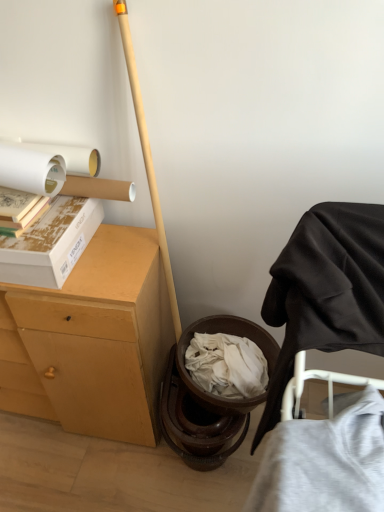
The height and width of the screenshot is (512, 384). Describe the element at coordinates (97, 337) in the screenshot. I see `light brown wood desk at left` at that location.

The width and height of the screenshot is (384, 512). Describe the element at coordinates (326, 291) in the screenshot. I see `black fabric chair at right` at that location.

What do you see at coordinates (44, 166) in the screenshot? I see `white matte toilet paper at upper left` at bounding box center [44, 166].

Measure the distance between point (46, 247) and camera.

The distance of point (46, 247) from camera is 1.04 meters.

What do you see at coordinates (50, 243) in the screenshot? I see `white cardboard box at upper left` at bounding box center [50, 243].

This screenshot has width=384, height=512. Find the location of `light brown wood desk at left`. light brown wood desk at left is located at coordinates (97, 337).

Would you say gray cotton t-shirt at lower right is inside or outside white matte toilet paper at upper left?

gray cotton t-shirt at lower right is spatially situated outside white matte toilet paper at upper left.

Considering the sizes of gray cotton t-shirt at lower right and white matte toilet paper at upper left in the image, is gray cotton t-shirt at lower right taller or shorter than white matte toilet paper at upper left?

Clearly, gray cotton t-shirt at lower right is taller compared to white matte toilet paper at upper left.

In terms of size, does gray cotton t-shirt at lower right appear bigger or smaller than white matte toilet paper at upper left?

Clearly, gray cotton t-shirt at lower right is larger in size than white matte toilet paper at upper left.

This screenshot has height=512, width=384. I want to click on toilet paper lying above the gray cotton t-shirt at lower right (from the image's perspective), so click(x=44, y=166).

From the image's perspective, would you say matte cardboard book at upper left is shown under white cardboard box at upper left?

No, from the image's perspective, matte cardboard book at upper left is not beneath white cardboard box at upper left.

Between matte cardboard book at upper left and white cardboard box at upper left, which one has less height?

matte cardboard book at upper left.

Find the location of a particular element. This screenshot has width=384, height=512. box that is under the matte cardboard book at upper left (from a real-world perspective) is located at coordinates (50, 243).

Considering the sizes of matte cardboard book at upper left and light brown wood desk at left in the image, is matte cardboard book at upper left taller or shorter than light brown wood desk at left?

matte cardboard book at upper left is shorter than light brown wood desk at left.

Considering the sizes of matte cardboard book at upper left and light brown wood desk at left in the image, is matte cardboard book at upper left wider or thinner than light brown wood desk at left?

Considering their sizes, matte cardboard book at upper left looks slimmer than light brown wood desk at left.

Can you confirm if matte cardboard book at upper left is smaller than light brown wood desk at left?

Yes, matte cardboard book at upper left is smaller than light brown wood desk at left.

Is matte cardboard book at upper left positioned with its back to light brown wood desk at left?

matte cardboard book at upper left does not have its back to light brown wood desk at left.

Considering the relative positions of white cardboard box at upper left and white matte toilet paper at upper left in the image provided, is white cardboard box at upper left to the right of white matte toilet paper at upper left from the viewer's perspective?

No, white cardboard box at upper left is not to the right of white matte toilet paper at upper left.

Does white cardboard box at upper left turn towards white matte toilet paper at upper left?

No.

Based on the photo, is white cardboard box at upper left placed right next to white matte toilet paper at upper left?

white cardboard box at upper left is not next to white matte toilet paper at upper left, and they're not touching.

Considering the sizes of white cardboard box at upper left and white matte toilet paper at upper left in the image, is white cardboard box at upper left taller or shorter than white matte toilet paper at upper left?

In the image, white cardboard box at upper left appears to be taller than white matte toilet paper at upper left.

Can you tell me how much gray cotton t-shirt at lower right and white cardboard box at upper left differ in facing direction?

90.5 degrees.

Is gray cotton t-shirt at lower right oriented towards white cardboard box at upper left?

No, gray cotton t-shirt at lower right is not oriented towards white cardboard box at upper left.

Considering the positions of objects gray cotton t-shirt at lower right and white cardboard box at upper left in the image provided, who is behind, gray cotton t-shirt at lower right or white cardboard box at upper left?

white cardboard box at upper left is further from the camera.

Consider the image. Does light brown wood desk at left appear on the left side of gray cotton t-shirt at lower right?

Correct, you'll find light brown wood desk at left to the left of gray cotton t-shirt at lower right.

Does light brown wood desk at left come behind gray cotton t-shirt at lower right?

Yes, the depth of light brown wood desk at left is greater than that of gray cotton t-shirt at lower right.

Is light brown wood desk at left placed right next to gray cotton t-shirt at lower right?

No, light brown wood desk at left is not with gray cotton t-shirt at lower right.

How different are the orientations of gray cotton t-shirt at lower right and matte cardboard book at upper left in degrees?

The facing directions of gray cotton t-shirt at lower right and matte cardboard book at upper left are 90.9 degrees apart.

In the scene shown: Is gray cotton t-shirt at lower right taller than matte cardboard book at upper left?

Yes, gray cotton t-shirt at lower right is taller than matte cardboard book at upper left.

From the image's perspective, is gray cotton t-shirt at lower right under matte cardboard book at upper left?

Correct, gray cotton t-shirt at lower right appears lower than matte cardboard book at upper left in the image.

Is gray cotton t-shirt at lower right at the right side of matte cardboard book at upper left?

Indeed, gray cotton t-shirt at lower right is positioned on the right side of matte cardboard book at upper left.

You are a GUI agent. You are given a task and a screenshot of the screen. Output one action in this format:
    pyautogui.click(x=<x>, y=<y>)
    Task: Click on the clothing that is on the right side of white matte toilet paper at upper left
    
    Given the screenshot: What is the action you would take?
    pyautogui.click(x=325, y=461)

Find the location of `box below the matte cardboard book at upper left (from the image's perspective)`. box below the matte cardboard book at upper left (from the image's perspective) is located at coordinates (50, 243).

Looking at the image, which one is located further to light brown wood desk at left, white cardboard box at upper left or white matte toilet paper at upper left?

white matte toilet paper at upper left.

Based on the photo, from the image, which object appears to be farther from gray cotton t-shirt at lower right, matte cardboard book at upper left or light brown wood desk at left?

Based on the image, matte cardboard book at upper left appears to be further to gray cotton t-shirt at lower right.

From the image, which object appears to be farther from white matte toilet paper at upper left, matte cardboard book at upper left or black fabric chair at right?

black fabric chair at right is further to white matte toilet paper at upper left.

Looking at the image, which one is located further to matte cardboard book at upper left, black fabric chair at right or white cardboard box at upper left?

black fabric chair at right is further to matte cardboard book at upper left.

Looking at the image, which one is located closer to matte cardboard book at upper left, light brown wood desk at left or gray cotton t-shirt at lower right?

light brown wood desk at left is closer to matte cardboard book at upper left.

Considering their positions, is white matte toilet paper at upper left positioned closer to black fabric chair at right than light brown wood desk at left?

Based on the image, light brown wood desk at left appears to be nearer to black fabric chair at right.

Based on the photo, based on their spatial positions, is black fabric chair at right or white cardboard box at upper left further from gray cotton t-shirt at lower right?

Among the two, white cardboard box at upper left is located further to gray cotton t-shirt at lower right.

When comparing their distances from white cardboard box at upper left, does matte cardboard book at upper left or light brown wood desk at left seem closer?

The object closer to white cardboard box at upper left is matte cardboard book at upper left.

At what (x,y) coordinates should I click in order to perform the action: click on box between matte cardboard book at upper left and gray cotton t-shirt at lower right from left to right. Please return your answer as a coordinate pair (x, y). Image resolution: width=384 pixels, height=512 pixels. Looking at the image, I should click on (50, 243).

Locate an element on the screen. The width and height of the screenshot is (384, 512). toilet paper situated between white cardboard box at upper left and gray cotton t-shirt at lower right from left to right is located at coordinates (44, 166).

Find the location of `box located between matte cardboard book at upper left and black fabric chair at right in the left-right direction`. box located between matte cardboard book at upper left and black fabric chair at right in the left-right direction is located at coordinates 50,243.

Locate an element on the screen. The height and width of the screenshot is (512, 384). desk situated between matte cardboard book at upper left and gray cotton t-shirt at lower right from left to right is located at coordinates coord(97,337).